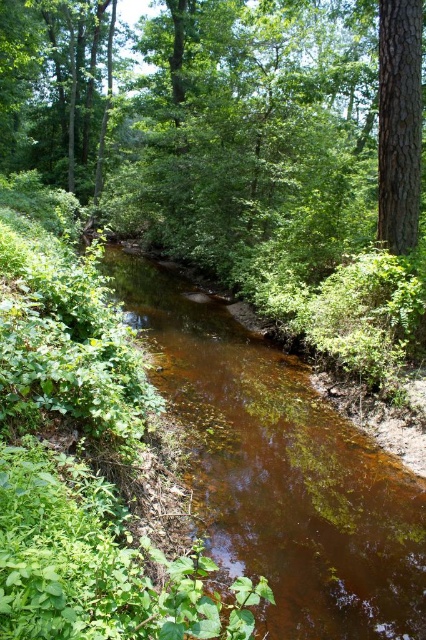
Based on the photo, between brown translucent water at center and smooth brown tree trunk at upper right, which one is positioned lower?

brown translucent water at center is lower down.

Between brown translucent water at center and smooth brown tree trunk at upper right, which one has more height?

smooth brown tree trunk at upper right

Is point (256, 499) positioned in front of point (380, 61)?

Yes, it is in front of point (380, 61).

Where is `brown translucent water at center`? The width and height of the screenshot is (426, 640). brown translucent water at center is located at coordinates (279, 468).